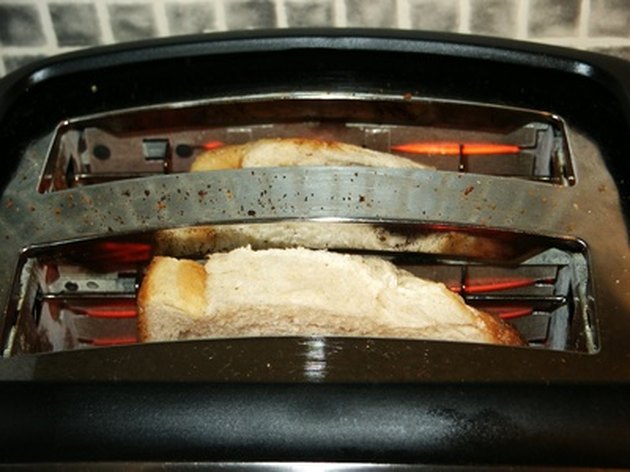
The height and width of the screenshot is (472, 630). I want to click on black housing of toaster, so click(x=559, y=72).